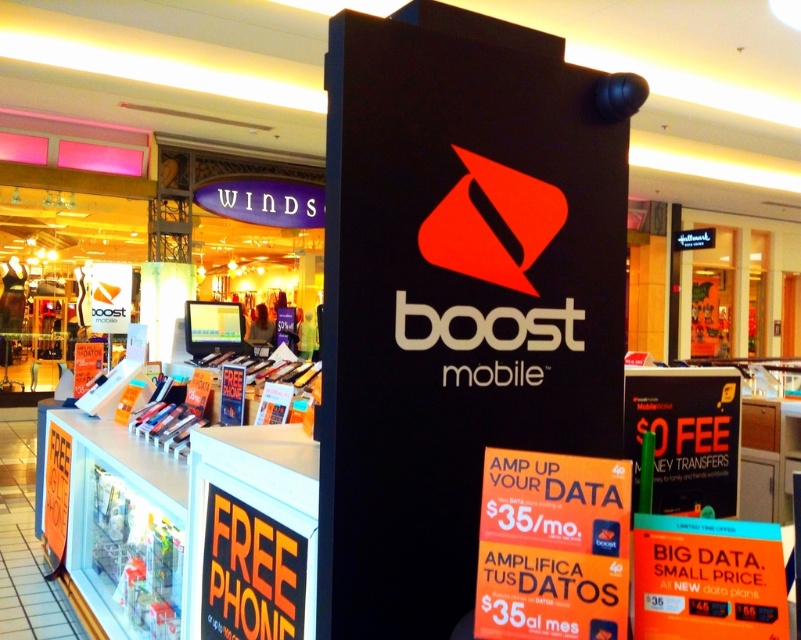
You are a customer looking at the Boost Mobile store. You see the black matte sign at center and the orange paper sign at center. Which one is more to the left?

The black matte sign at center is positioned on the left side of orange paper sign at center, so it is more to the left.